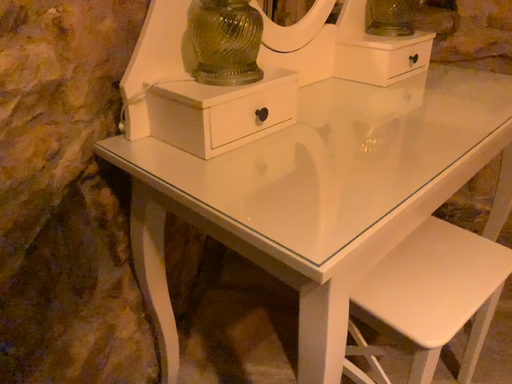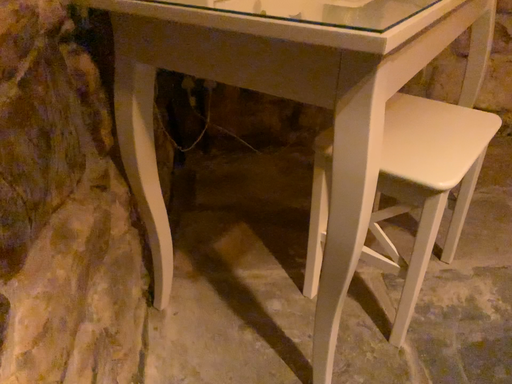
Question: How did the camera likely rotate when shooting the video?

Choices:
 (A) rotated right
 (B) rotated left

Answer: (A)